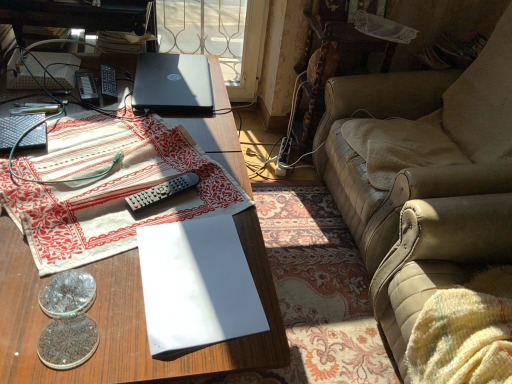
At what (x,y) coordinates should I click in order to perform the action: click on vacant space to the left of translucent glass coins at lower left, the first coin viewed from the front. Please return your answer as a coordinate pair (x, y). Image resolution: width=512 pixels, height=384 pixels. Looking at the image, I should click on (15, 314).